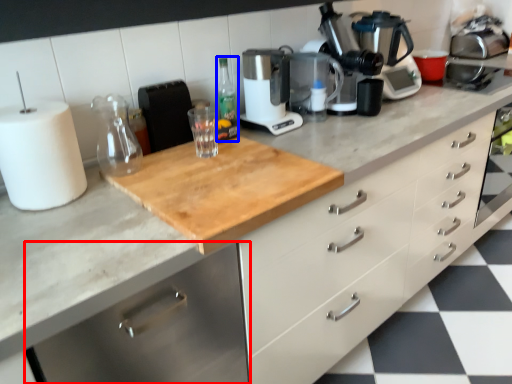
Question: Among these objects, which one is nearest to the camera, cabinetry (highlighted by a red box) or bottle (highlighted by a blue box)?

Choices:
 (A) cabinetry
 (B) bottle

Answer: (A)